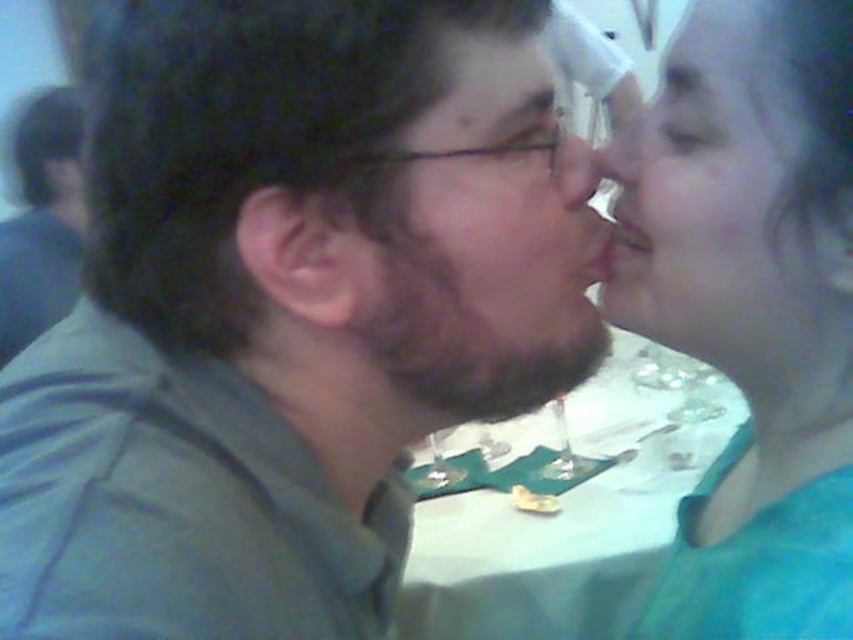
Question: Can you confirm if matte green shirt at center is thinner than smooth skin face at upper right?

Choices:
 (A) no
 (B) yes

Answer: (A)

Question: Which point is closer to the camera taking this photo?

Choices:
 (A) (755, 164)
 (B) (704, 104)
 (C) (570, 172)

Answer: (A)

Question: Among these points, which one is farthest from the camera?

Choices:
 (A) (614, 260)
 (B) (570, 182)
 (C) (761, 115)

Answer: (A)

Question: Considering the real-world distances, which object is farthest from the smooth skin face at upper right?

Choices:
 (A) matte green shirt at center
 (B) smooth teal shirt at right
 (C) matte gray shirt at left

Answer: (C)

Question: Is matte gray shirt at left positioned behind smooth skin nose at center?

Choices:
 (A) yes
 (B) no

Answer: (B)

Question: Is the position of matte green shirt at center less distant than that of smooth skin nose at center?

Choices:
 (A) no
 (B) yes

Answer: (B)